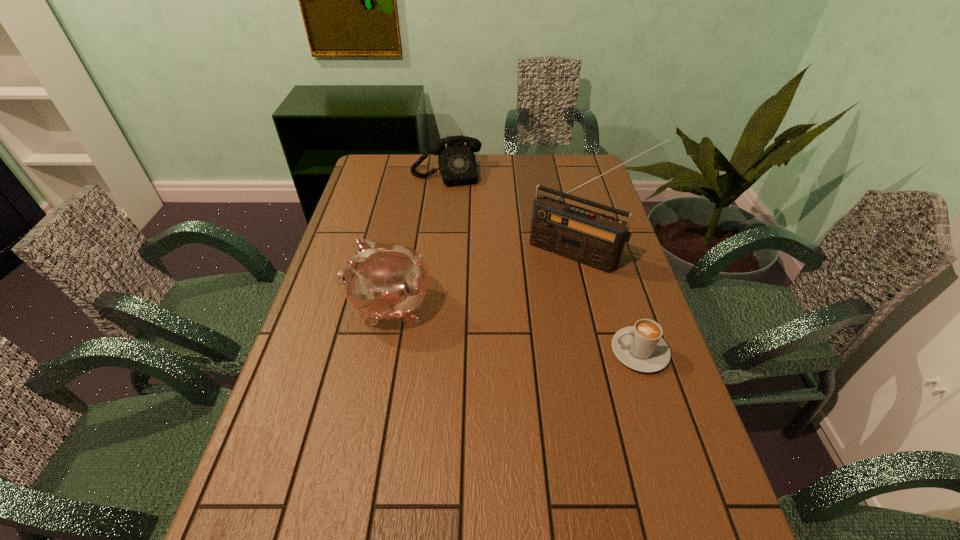
This screenshot has width=960, height=540. Identify the location of vacant space on the desktop that is between the piggy bank and the cappuccino and is positioned on the dial of the second shortest object. (476, 322).

Locate an element on the screen. The height and width of the screenshot is (540, 960). free space on the desktop that is between the second tallest object and the cappuccino and is positioned on the front-facing side of the radio receiver is located at coordinates (525, 331).